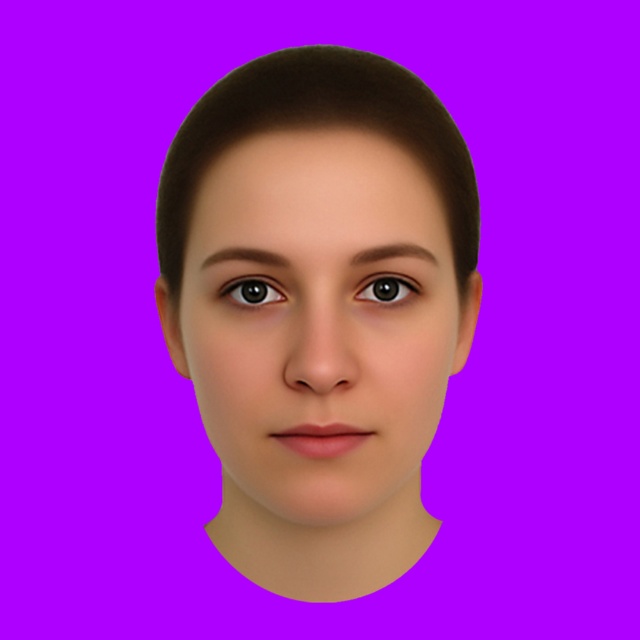
Question: Observing the image, what is the correct spatial positioning of brown glossy eye at upper left in reference to brown glossy eye at center?

Choices:
 (A) left
 (B) right

Answer: (A)

Question: Which object is farther from the camera taking this photo?

Choices:
 (A) smooth skin face at center
 (B) brown glossy eye at upper left
 (C) brown matte hair at center

Answer: (B)

Question: Which point is farther from the camera taking this photo?

Choices:
 (A) (387, 292)
 (B) (305, 124)

Answer: (A)

Question: Which point appears closest to the camera in this image?

Choices:
 (A) (465, 244)
 (B) (408, 337)
 (C) (376, 276)
 (D) (241, 289)

Answer: (B)

Question: Does brown glossy eye at upper left appear on the right side of brown glossy eye at center?

Choices:
 (A) no
 (B) yes

Answer: (A)

Question: Where is smooth skin face at center located in relation to brown glossy eye at upper left in the image?

Choices:
 (A) above
 (B) below

Answer: (B)